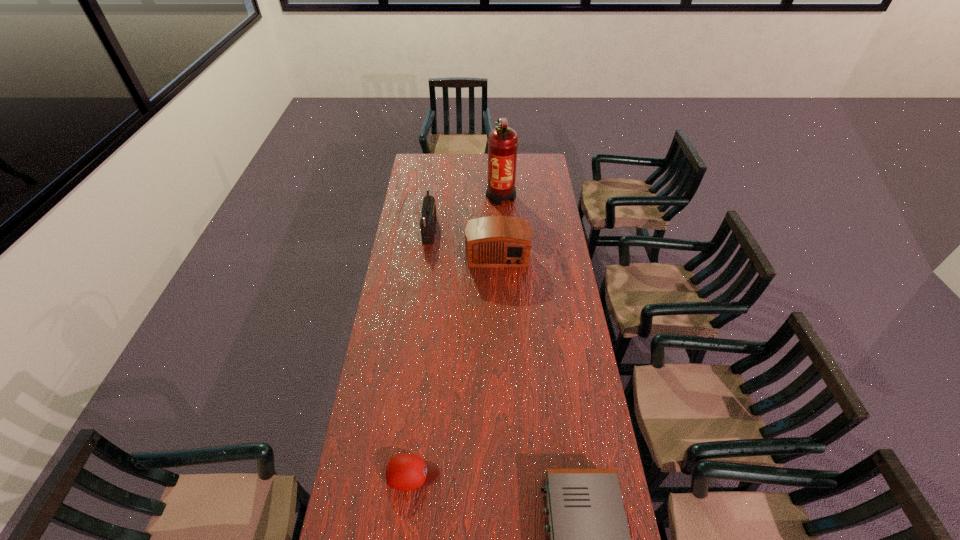
The width and height of the screenshot is (960, 540). What are the coordinates of `fire extinguisher` in the screenshot? It's located at (503, 141).

You are a GUI agent. You are given a task and a screenshot of the screen. Output one action in this format:
    pyautogui.click(x=<x>, y=<y>)
    Task: Click on the farthest object
    
    Given the screenshot: What is the action you would take?
    pyautogui.click(x=503, y=141)

This screenshot has height=540, width=960. In order to click on the second tallest object in this screenshot , I will do `click(428, 211)`.

Locate an element on the screen. the leftmost radio receiver is located at coordinates (428, 211).

Locate an element on the screen. This screenshot has height=540, width=960. the second tallest radio receiver is located at coordinates (493, 241).

At what (x,y) coordinates should I click in order to perform the action: click on baseball cap. Please return your answer as a coordinate pair (x, y). Looking at the image, I should click on (405, 472).

In order to click on free location located on the front-facing side of the farthest object in this screenshot , I will do `click(503, 239)`.

The width and height of the screenshot is (960, 540). I want to click on free space located on the front-facing side of the leftmost radio receiver, so click(x=473, y=227).

This screenshot has width=960, height=540. In order to click on free space located 0.290m on the front-facing side of the second shortest radio receiver in this screenshot , I will do `click(500, 318)`.

This screenshot has width=960, height=540. In order to click on vacant space positioned on the front-facing side of the baseball cap in this screenshot , I will do `click(461, 474)`.